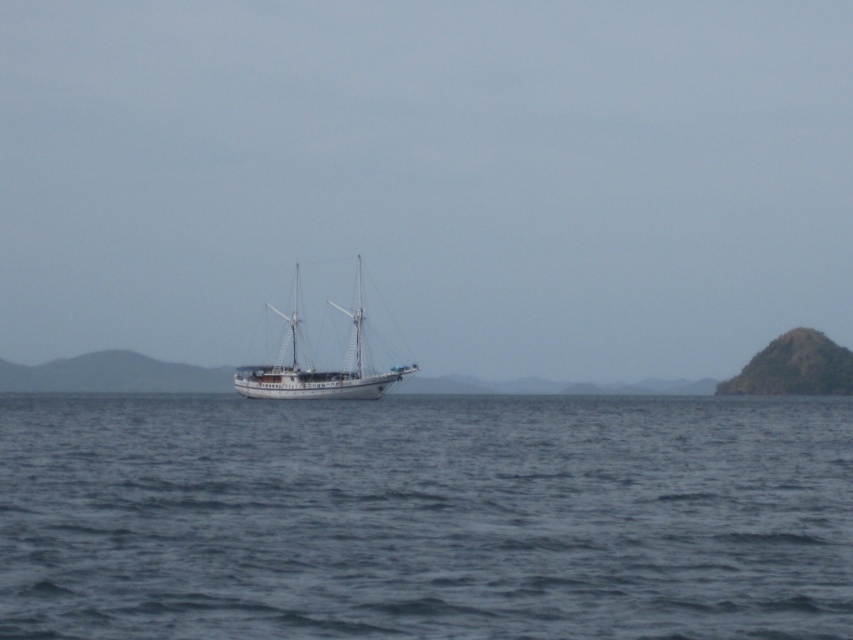
Is blue water at center smaller than white matte sailboat at center?

Correct, blue water at center occupies less space than white matte sailboat at center.

Is point (453, 598) more distant than point (346, 380)?

No, (453, 598) is closer to viewer.

This screenshot has width=853, height=640. Describe the element at coordinates (425, 516) in the screenshot. I see `blue water at center` at that location.

I want to click on blue water at center, so click(425, 516).

Can you confirm if white matte sailboat at center is positioned to the left of green rocky island at right?

Correct, you'll find white matte sailboat at center to the left of green rocky island at right.

The width and height of the screenshot is (853, 640). I want to click on white matte sailboat at center, so click(x=315, y=369).

Can you confirm if blue water at center is smaller than green rocky island at right?

Incorrect, blue water at center is not smaller in size than green rocky island at right.

Is point (53, 400) closer to camera compared to point (773, 348)?

Yes.

Where is `blue water at center`? blue water at center is located at coordinates (425, 516).